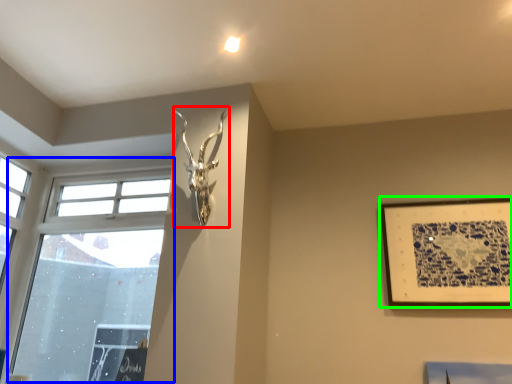
Question: Estimate the real-world distances between objects in this image. Which object is farther from sculpture (highlighted by a red box), window (highlighted by a blue box) or picture frame (highlighted by a green box)?

Choices:
 (A) window
 (B) picture frame

Answer: (B)